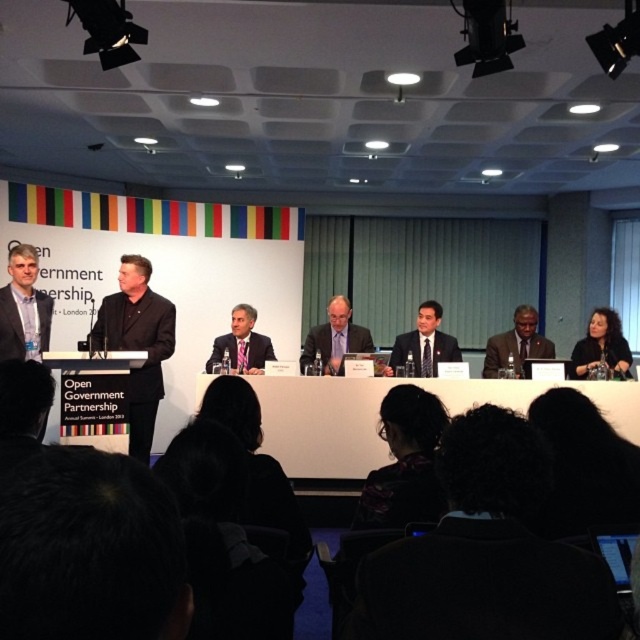
Question: Is white glossy table at center bigger than matte black suit at center?

Choices:
 (A) yes
 (B) no

Answer: (A)

Question: Among these points, which one is nearest to the camera?

Choices:
 (A) (424, 433)
 (B) (292, 461)
 (C) (134, 336)

Answer: (A)

Question: Which of these objects is positioned closest to the black matte suit at center?

Choices:
 (A) white glossy table at center
 (B) matte black suit at center
 (C) dark hair at upper right
 (D) dark blue suit at center

Answer: (B)

Question: Can you confirm if dark curly hair at lower center is positioned above dark brown suit at center?

Choices:
 (A) yes
 (B) no

Answer: (B)

Question: In this image, where is dark blue suit at center located relative to dark hair at upper right?

Choices:
 (A) above
 (B) below

Answer: (A)

Question: Which of the following is the closest to the observer?

Choices:
 (A) (579, 371)
 (B) (324, 397)

Answer: (B)